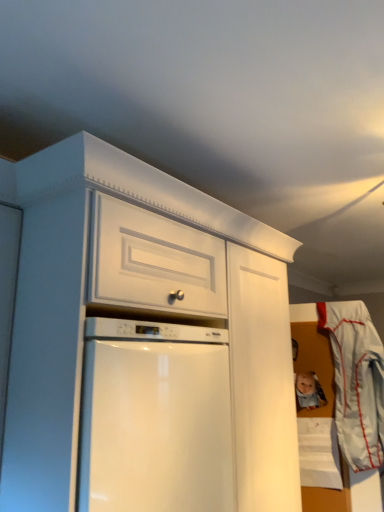
What do you see at coordinates (356, 381) in the screenshot? Image resolution: width=384 pixels, height=512 pixels. I see `white fabric laundry at right` at bounding box center [356, 381].

Where is `white fabric laundry at right`? white fabric laundry at right is located at coordinates (356, 381).

This screenshot has height=512, width=384. What do you see at coordinates (309, 391) in the screenshot?
I see `matte plastic toy at lower right` at bounding box center [309, 391].

The image size is (384, 512). Identify the location of matte plastic toy at lower right. point(309,391).

Locate an element on the screen. This screenshot has width=384, height=512. white fabric laundry at right is located at coordinates (356, 381).

Which object is positioned more to the right, white fabric laundry at right or matte plastic toy at lower right?

white fabric laundry at right is more to the right.

Is white fabric laundry at right positioned behind matte plastic toy at lower right?

No.

Considering the points (348, 304) and (314, 390), which point is behind, point (348, 304) or point (314, 390)?

The point (348, 304) is more distant.

From the image's perspective, which object appears higher, white fabric laundry at right or matte plastic toy at lower right?

matte plastic toy at lower right.

From a real-world perspective, is white fabric laundry at right positioned under matte plastic toy at lower right based on gravity?

Yes, from a real-world perspective, white fabric laundry at right is below matte plastic toy at lower right.

Considering the relative sizes of white fabric laundry at right and matte plastic toy at lower right in the image provided, is white fabric laundry at right thinner than matte plastic toy at lower right?

No.

Considering the relative sizes of white fabric laundry at right and matte plastic toy at lower right in the image provided, is white fabric laundry at right shorter than matte plastic toy at lower right?

No.

Looking at the image, does white fabric laundry at right seem bigger or smaller compared to matte plastic toy at lower right?

In the image, white fabric laundry at right appears to be larger than matte plastic toy at lower right.

Is white fabric laundry at right inside or outside of matte plastic toy at lower right?

white fabric laundry at right is spatially situated outside matte plastic toy at lower right.

Are white fabric laundry at right and matte plastic toy at lower right located far from each other?

white fabric laundry at right is actually quite close to matte plastic toy at lower right.

Is matte plastic toy at lower right at the back of white fabric laundry at right?

No, matte plastic toy at lower right is not at the back of white fabric laundry at right.

How different are the orientations of white fabric laundry at right and matte plastic toy at lower right in degrees?

The angle between the facing direction of white fabric laundry at right and the facing direction of matte plastic toy at lower right is 180 degrees.

Identify the location of laundry lying in front of the matte plastic toy at lower right. (356, 381).

Is matte plastic toy at lower right to the right of white fabric laundry at right from the viewer's perspective?

No.

Which object is more forward, matte plastic toy at lower right or white fabric laundry at right?

Positioned in front is white fabric laundry at right.

Is point (314, 375) closer or farther from the camera than point (365, 383)?

Point (314, 375) is farther from the camera than point (365, 383).

From the image's perspective, which object appears higher, matte plastic toy at lower right or white fabric laundry at right?

matte plastic toy at lower right.

From the picture: From a real-world perspective, is matte plastic toy at lower right located beneath white fabric laundry at right?

No, from a real-world perspective, matte plastic toy at lower right is not under white fabric laundry at right.

Considering the sizes of objects matte plastic toy at lower right and white fabric laundry at right in the image provided, who is thinner, matte plastic toy at lower right or white fabric laundry at right?

Thinner between the two is matte plastic toy at lower right.

Does matte plastic toy at lower right have a greater height compared to white fabric laundry at right?

No.

Who is smaller, matte plastic toy at lower right or white fabric laundry at right?

matte plastic toy at lower right is smaller.

Is matte plastic toy at lower right positioned beyond the bounds of white fabric laundry at right?

matte plastic toy at lower right is positioned outside white fabric laundry at right.

Is matte plastic toy at lower right not near white fabric laundry at right?

No, there isn't a large distance between matte plastic toy at lower right and white fabric laundry at right.

Is matte plastic toy at lower right aimed at white fabric laundry at right?

No, matte plastic toy at lower right does not turn towards white fabric laundry at right.

What's the angular difference between matte plastic toy at lower right and white fabric laundry at right's facing directions?

The angle between the facing direction of matte plastic toy at lower right and the facing direction of white fabric laundry at right is 180 degrees.

Measure the distance between matte plastic toy at lower right and white fabric laundry at right.

They are 8.21 inches apart.

Image resolution: width=384 pixels, height=512 pixels. I want to click on toy that is on the left side of white fabric laundry at right, so click(309, 391).

At what (x,y) coordinates should I click in order to perform the action: click on laundry below the matte plastic toy at lower right (from the image's perspective). Please return your answer as a coordinate pair (x, y). The image size is (384, 512). Looking at the image, I should click on (356, 381).

Find the location of a particular element. toy on the left side of white fabric laundry at right is located at coordinates (309, 391).